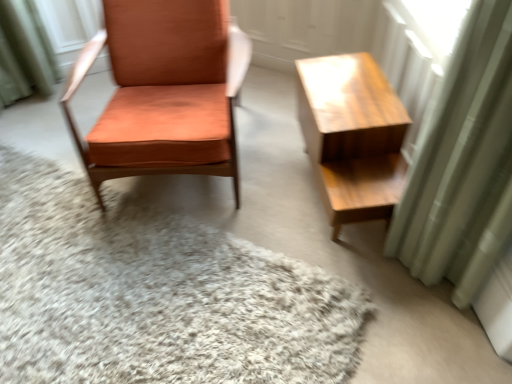
You are a GUI agent. You are given a task and a screenshot of the screen. Output one action in this format:
    pyautogui.click(x=<x>, y=<y>)
    Task: Click on the white shaggy rug at center
    This screenshot has height=384, width=512.
    Given the screenshot: What is the action you would take?
    pyautogui.click(x=155, y=294)

Identify the location of orange leather chair at left. (164, 91).

What is the approximate height of light brown wood table at right?

Result: It is 17.92 inches.

At what (x,y) coordinates should I click in order to perform the action: click on light brown wood table at right. Please return your answer as a coordinate pair (x, y). The width and height of the screenshot is (512, 384). Looking at the image, I should click on (352, 135).

Locate an element on the screen. white shaggy rug at center is located at coordinates (155, 294).

Between light brown wood table at right and white shaggy rug at center, which one has less height?

Standing shorter between the two is white shaggy rug at center.

Is white shaggy rug at center at the back of light brown wood table at right?

No, white shaggy rug at center is not at the back of light brown wood table at right.

From the image's perspective, between light brown wood table at right and white shaggy rug at center, which one is located above?

From the image's view, light brown wood table at right is above.

Is point (324, 107) in front of point (247, 281)?

No, (324, 107) is further to viewer.

Is orange leather chair at left next to light brown wood table at right?

No, orange leather chair at left is not in contact with light brown wood table at right.

From a real-world perspective, between orange leather chair at left and light brown wood table at right, who is vertically lower?

light brown wood table at right, from a real-world perspective.

Considering the sizes of objects orange leather chair at left and light brown wood table at right in the image provided, who is wider, orange leather chair at left or light brown wood table at right?

orange leather chair at left.

Considering the positions of objects orange leather chair at left and light brown wood table at right in the image provided, who is more to the left, orange leather chair at left or light brown wood table at right?

From the viewer's perspective, orange leather chair at left appears more on the left side.

Could you tell me if orange leather chair at left is turned towards white shaggy rug at center?

Yes, orange leather chair at left faces towards white shaggy rug at center.

Is orange leather chair at left at the right side of white shaggy rug at center?

Indeed, orange leather chair at left is positioned on the right side of white shaggy rug at center.

Considering the sizes of orange leather chair at left and white shaggy rug at center in the image, is orange leather chair at left bigger or smaller than white shaggy rug at center?

Considering their sizes, orange leather chair at left takes up more space than white shaggy rug at center.

From the image's perspective, is orange leather chair at left located above white shaggy rug at center?

Indeed, from the image's perspective, orange leather chair at left is shown above white shaggy rug at center.

Considering the sizes of green fabric curtain at right and orange leather chair at left in the image, is green fabric curtain at right wider or thinner than orange leather chair at left?

In the image, green fabric curtain at right appears to be more narrow than orange leather chair at left.

From a real-world perspective, is green fabric curtain at right positioned over orange leather chair at left based on gravity?

Yes, from a real-world perspective, green fabric curtain at right is on top of orange leather chair at left.

Which of these two, green fabric curtain at right or orange leather chair at left, stands shorter?

With less height is orange leather chair at left.

From the image's perspective, relative to orange leather chair at left, is green fabric curtain at right above or below?

green fabric curtain at right is situated lower than orange leather chair at left in the image.

From a real-world perspective, is green fabric curtain at right on top of light brown wood table at right?

Indeed, from a real-world perspective, green fabric curtain at right stands above light brown wood table at right.

Is green fabric curtain at right positioned with its back to light brown wood table at right?

Yes, light brown wood table at right is at the back of green fabric curtain at right.

Is green fabric curtain at right in front of or behind light brown wood table at right in the image?

Visually, green fabric curtain at right is located in front of light brown wood table at right.

How many degrees apart are the facing directions of green fabric curtain at right and light brown wood table at right?

0.636 degrees.

Is white shaggy rug at center positioned before light brown wood table at right?

Yes, white shaggy rug at center is closer to the viewer.

Do you think white shaggy rug at center is within light brown wood table at right, or outside of it?

white shaggy rug at center cannot be found inside light brown wood table at right.

What's the angular difference between white shaggy rug at center and light brown wood table at right's facing directions?

They differ by 36.4 degrees in their facing directions.

Could you tell me if white shaggy rug at center is facing light brown wood table at right?

No, white shaggy rug at center does not turn towards light brown wood table at right.

Based on the photo, is green fabric curtain at right thinner than white shaggy rug at center?

Yes, green fabric curtain at right is thinner than white shaggy rug at center.

Are green fabric curtain at right and white shaggy rug at center located far from each other?

That's not correct — green fabric curtain at right is a little close to white shaggy rug at center.

From the image's perspective, between green fabric curtain at right and white shaggy rug at center, which one is located above?

green fabric curtain at right, from the image's perspective.

Considering the sizes of objects green fabric curtain at right and white shaggy rug at center in the image provided, who is smaller, green fabric curtain at right or white shaggy rug at center?

green fabric curtain at right.

This screenshot has width=512, height=384. In order to click on mat on the left of the light brown wood table at right in this screenshot , I will do click(x=155, y=294).

Locate an element on the screen. Image resolution: width=512 pixels, height=384 pixels. table below the orange leather chair at left (from a real-world perspective) is located at coordinates (352, 135).

Estimate the real-world distances between objects in this image. Which object is further from green fabric curtain at right, white shaggy rug at center or orange leather chair at left?

The object further to green fabric curtain at right is orange leather chair at left.

Looking at the image, which one is located further to orange leather chair at left, white shaggy rug at center or light brown wood table at right?

light brown wood table at right is positioned further to the anchor orange leather chair at left.

Looking at the image, which one is located further to white shaggy rug at center, green fabric curtain at right or light brown wood table at right?

green fabric curtain at right lies further to white shaggy rug at center than the other object.

Looking at the image, which one is located closer to green fabric curtain at right, orange leather chair at left or white shaggy rug at center?

white shaggy rug at center lies closer to green fabric curtain at right than the other object.

Estimate the real-world distances between objects in this image. Which object is closer to green fabric curtain at right, light brown wood table at right or white shaggy rug at center?

light brown wood table at right is positioned closer to the anchor green fabric curtain at right.

When comparing their distances from orange leather chair at left, does light brown wood table at right or green fabric curtain at right seem further?

green fabric curtain at right.

Estimate the real-world distances between objects in this image. Which object is closer to light brown wood table at right, green fabric curtain at right or white shaggy rug at center?

The object closer to light brown wood table at right is green fabric curtain at right.

From the image, which object appears to be nearer to green fabric curtain at right, white shaggy rug at center or light brown wood table at right?

Based on the image, light brown wood table at right appears to be nearer to green fabric curtain at right.

Image resolution: width=512 pixels, height=384 pixels. I want to click on table between orange leather chair at left and green fabric curtain at right, so click(352, 135).

Locate an element on the screen. The width and height of the screenshot is (512, 384). table located between white shaggy rug at center and green fabric curtain at right in the left-right direction is located at coordinates (352, 135).

You are a GUI agent. You are given a task and a screenshot of the screen. Output one action in this format:
    pyautogui.click(x=<x>, y=<y>)
    Task: Click on the chair situated between white shaggy rug at center and light brown wood table at right from left to right
    This screenshot has width=512, height=384.
    Given the screenshot: What is the action you would take?
    point(164,91)

Image resolution: width=512 pixels, height=384 pixels. I want to click on chair between white shaggy rug at center and green fabric curtain at right, so click(x=164, y=91).